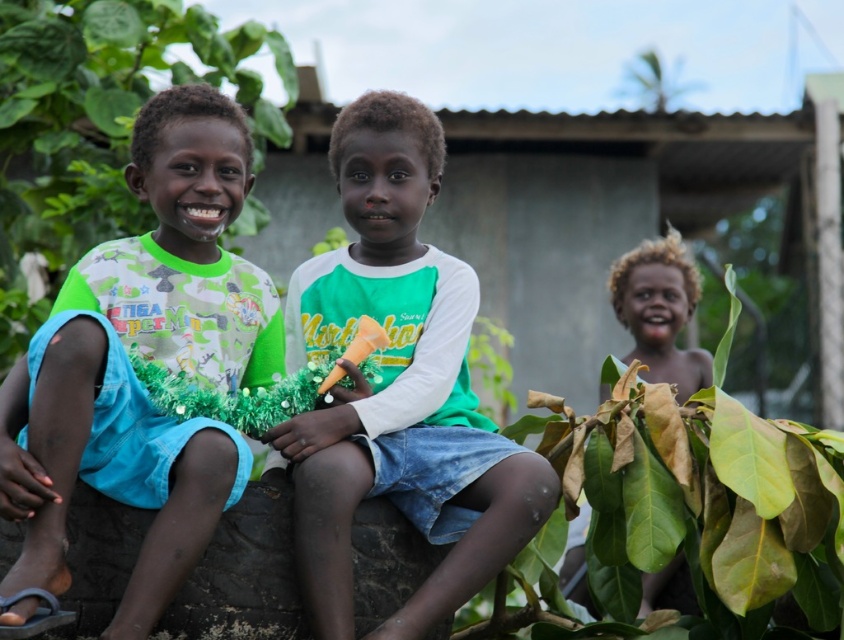
Question: Can you confirm if green leafy plant at left is bigger than light brown hair at lower right?

Choices:
 (A) no
 (B) yes

Answer: (A)

Question: Considering the relative positions of matte green t-shirt at left and green leafy plant at right in the image provided, where is matte green t-shirt at left located with respect to green leafy plant at right?

Choices:
 (A) right
 (B) left

Answer: (B)

Question: Which of the following is the closest to the observer?

Choices:
 (A) light brown hair at lower right
 (B) matte green t-shirt at left

Answer: (B)

Question: Which object is the closest to the matte green t-shirt at left?

Choices:
 (A) green matte shirt at center
 (B) green leafy plant at right
 (C) green leafy plant at left
 (D) light brown hair at lower right

Answer: (A)

Question: Among these points, which one is nearest to the camera?

Choices:
 (A) (214, 180)
 (B) (196, 45)

Answer: (A)

Question: Is green matte shirt at center to the right of green leafy plant at right from the viewer's perspective?

Choices:
 (A) no
 (B) yes

Answer: (A)